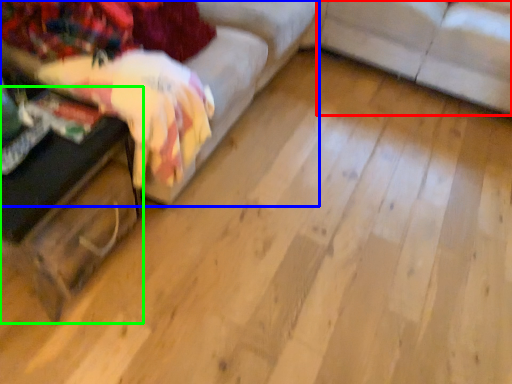
Question: Considering the real-world distances, which object is farthest from studio couch (highlighted by a red box)? studio couch (highlighted by a blue box) or table (highlighted by a green box)?

Choices:
 (A) studio couch
 (B) table

Answer: (B)